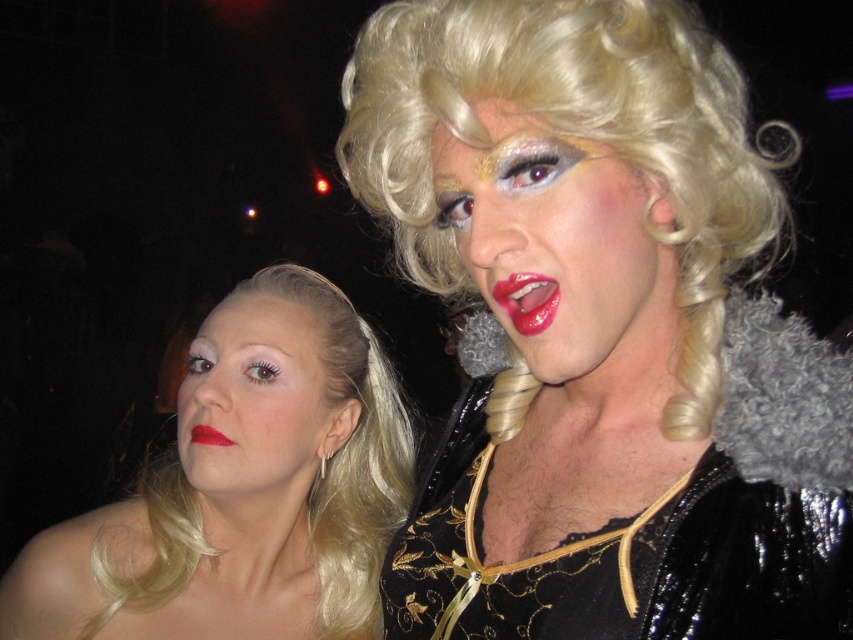
From the picture: You are a photographer at this event and want to capture a closeup of both the shiny blonde hair at center and the matte red lipstick at lower left in one frame. Since your camera has a fixed focus, which object should you prioritize focusing on to ensure clarity given their sizes?

The shiny blonde hair at center is larger in size than the matte red lipstick at lower left, so you should prioritize focusing on the shiny blonde hair at center to ensure clarity since larger objects require more precise focus for sharpness.

From the picture: You are a photographer at a drag show and want to capture a closeup of the matte skin face at lower left and the matte red lipstick at lower left. Since your camera can only focus on one subject at a time, which subject should you choose to ensure the larger one is in focus?

The matte skin face at lower left is larger in size than the matte red lipstick at lower left, so you should focus on the matte skin face at lower left to ensure the larger subject is in focus.